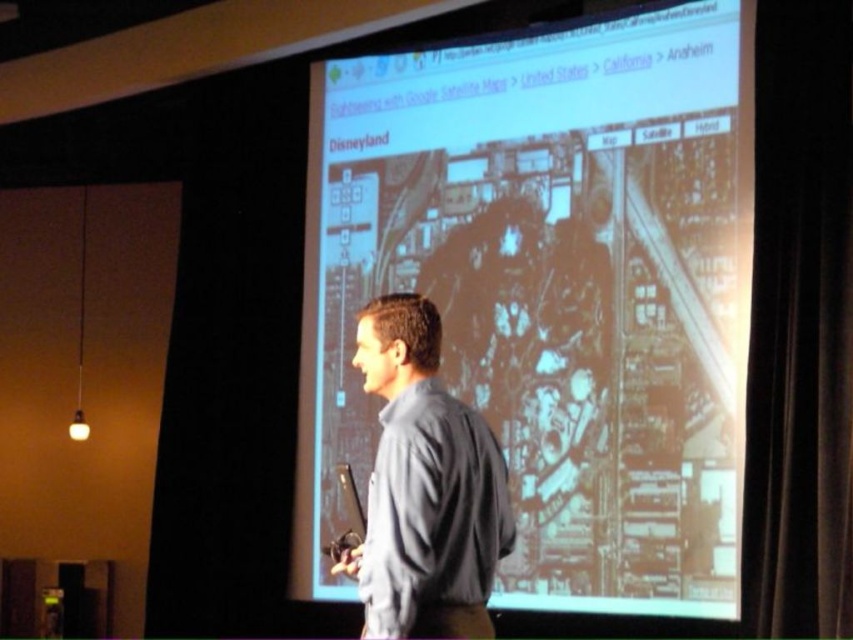
Does black velvet curtain at right appear over gray fabric shirt at center?

Yes, black velvet curtain at right is above gray fabric shirt at center.

Between black velvet curtain at right and gray fabric shirt at center, which one appears on the right side from the viewer's perspective?

black velvet curtain at right

At what (x,y) coordinates should I click in order to perform the action: click on black velvet curtain at right. Please return your answer as a coordinate pair (x, y). This screenshot has height=640, width=853. Looking at the image, I should click on (799, 326).

You are a GUI agent. You are given a task and a screenshot of the screen. Output one action in this format:
    pyautogui.click(x=<x>, y=<y>)
    Task: Click on the black velvet curtain at right
    The image size is (853, 640).
    Given the screenshot: What is the action you would take?
    pyautogui.click(x=799, y=326)

Measure the distance between matte black projector screen at center and gray fabric shirt at center.

A distance of 2.96 meters exists between matte black projector screen at center and gray fabric shirt at center.

Where is `matte black projector screen at center`? The width and height of the screenshot is (853, 640). matte black projector screen at center is located at coordinates (550, 291).

Where is `matte black projector screen at center`? matte black projector screen at center is located at coordinates (550, 291).

How far apart are matte black projector screen at center and black velvet curtain at right?

They are 1.33 meters apart.

Who is positioned more to the right, matte black projector screen at center or black velvet curtain at right?

black velvet curtain at right

Identify the location of matte black projector screen at center. This screenshot has width=853, height=640. (550, 291).

The image size is (853, 640). In order to click on matte black projector screen at center in this screenshot , I will do `click(550, 291)`.